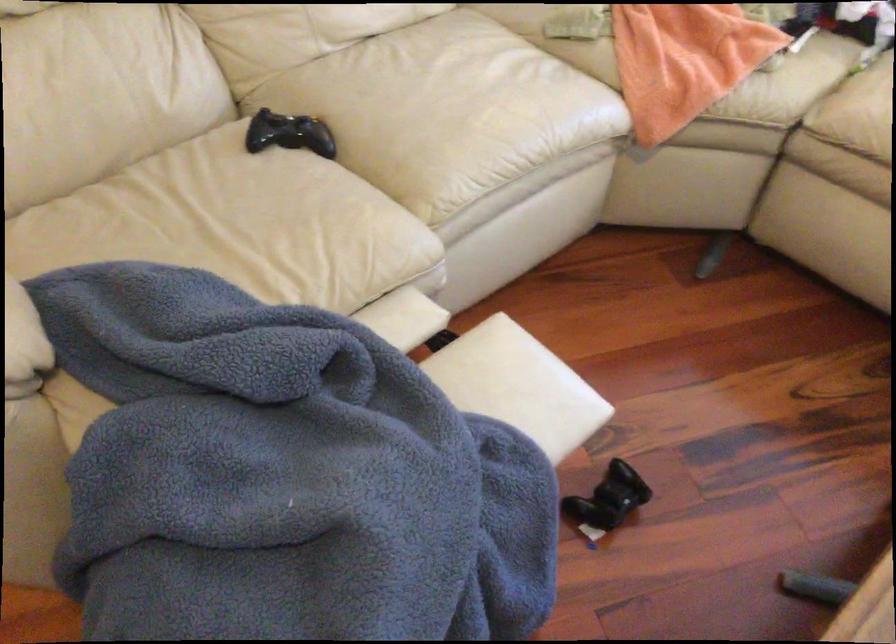
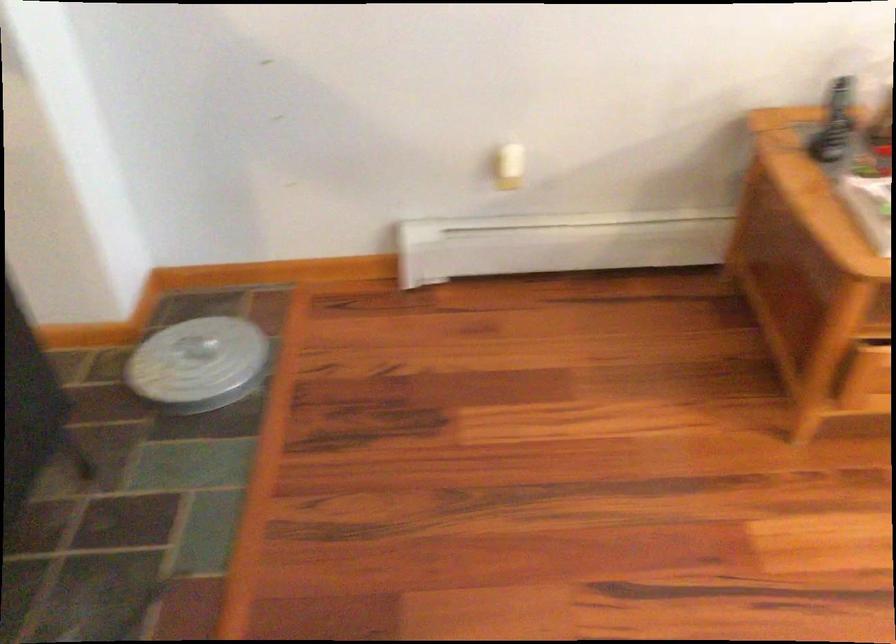
In a continuous first-person perspective shot, in which direction is the camera moving?

The cameraman walked toward left, forward.